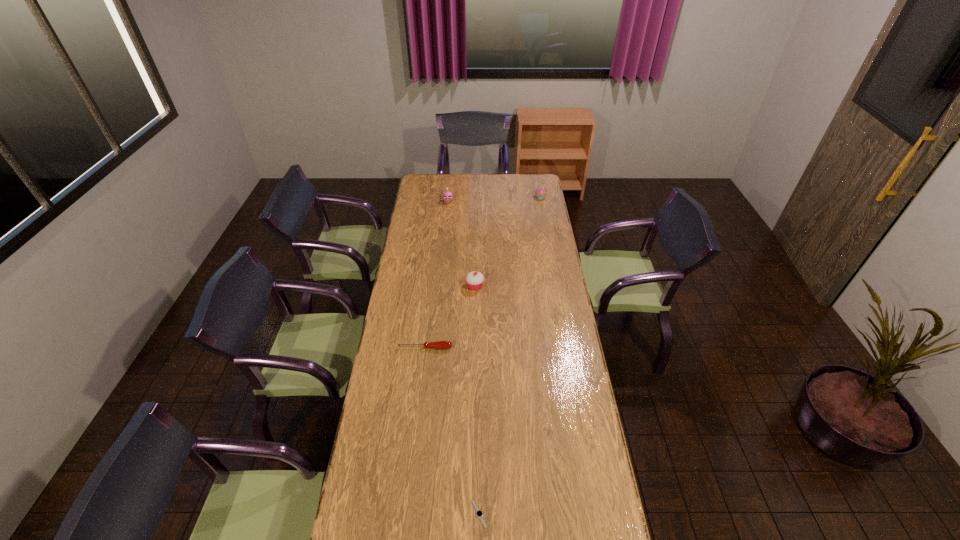
This screenshot has height=540, width=960. What are the coordinates of `vacant area that lies between the second cupcake from right to left and the rightmost cupcake` in the screenshot? It's located at (508, 242).

Where is `vacant area that lies between the nearest cupcake and the watch`? Image resolution: width=960 pixels, height=540 pixels. vacant area that lies between the nearest cupcake and the watch is located at coordinates (477, 400).

Identify the location of unoccupied area between the watch and the rightmost object. (510, 356).

The height and width of the screenshot is (540, 960). I want to click on free spot between the rightmost cupcake and the nearest cupcake, so click(508, 242).

Where is `free space between the rightmost object and the fourth farthest object`? Image resolution: width=960 pixels, height=540 pixels. free space between the rightmost object and the fourth farthest object is located at coordinates (483, 273).

Where is `unoccupied area between the screwdriver and the rightmost cupcake`? This screenshot has width=960, height=540. unoccupied area between the screwdriver and the rightmost cupcake is located at coordinates (483, 273).

Locate an element on the screen. Image resolution: width=960 pixels, height=540 pixels. empty space that is in between the leftmost cupcake and the third nearest object is located at coordinates (462, 244).

What are the coordinates of `empty space between the second cupcake from left to right and the second shortest object` in the screenshot? It's located at (450, 317).

Where is `object that is the second closest to the nearest object`? The width and height of the screenshot is (960, 540). object that is the second closest to the nearest object is located at coordinates (474, 279).

Find the location of a particular element. the fourth closest object to the screwdriver is located at coordinates (540, 192).